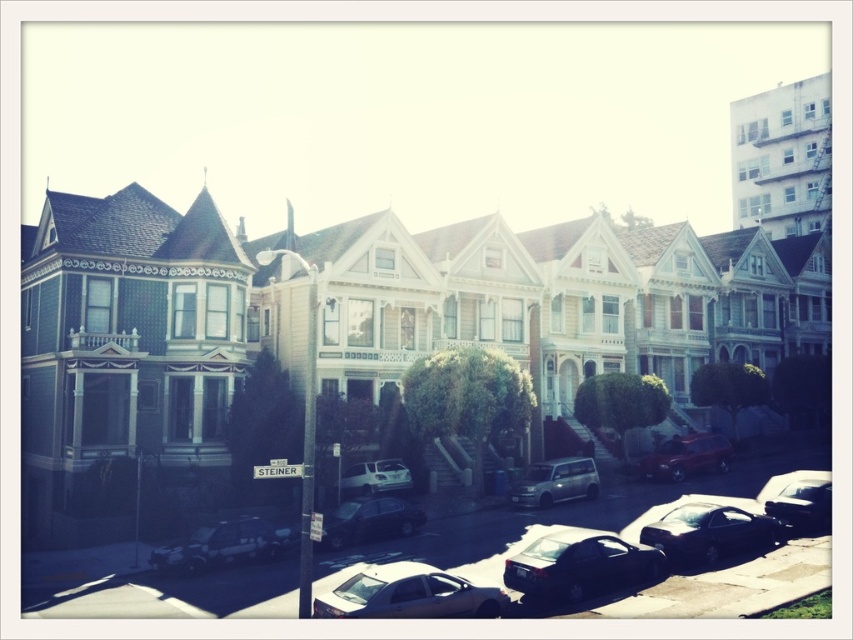
You are standing on the street looking at the Victorian houses. There are two points marked on the image, one at coordinates point (x=828, y=508) and another at point (x=703, y=468). Which point is nearer to you?

Point (x=828, y=508) is closer to the viewer than point (x=703, y=468).

You are a photographer standing at the end of the street. You want to capture a photo of the point at coordinates point (820, 522). If your camera has a maximum focus range of 50 meters, will you be able to focus on the point?

The distance of point (820, 522) from viewer is 45.51 meters, which is within the camera maximum focus range of 50 meters. So yes, the camera can focus on the point.

You are a delivery person trying to park your 1.8 meters tall delivery box in the space between the silver metallic sedan at center and the shiny black car at lower right. Can the delivery box fit vertically between them?

The silver metallic sedan at center is taller than the shiny black car at lower right. Since the delivery box is 1.8 meters tall, it can fit vertically between them as long as the height difference between the two cars allows enough space. However, without knowing the exact height of either car, we cannot confirm if the space is sufficient. Please check the actual heights of both vehicles.